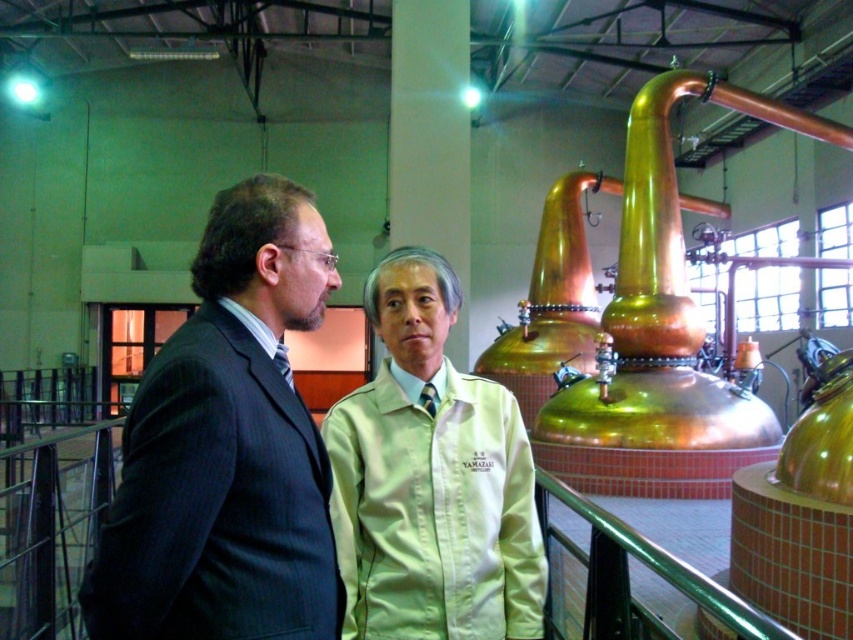
You are a photographer setting up a shoot in this distillery. You need to ensure that the dark gray pinstripe suit at left and the light beige fabric shirt at center are both visible in the frame. Given their sizes, which one might require more careful framing to ensure it doesn not get lost in the background of the industrial stills?

The dark gray pinstripe suit at left has a smaller size compared to light beige fabric shirt at center, so it might require more careful framing to ensure it doesn not get lost in the background of the industrial stills.

In the scene shown: You are standing at the origin point of the coordinate system in this image. The dark gray pinstripe suit at left is located at point (227, 448). If you were to walk directly towards the dark gray pinstripe suit at left, would you first encounter the dark gray pinstripe suit at left or the green railing before reaching it?

The dark gray pinstripe suit at left is located at point (227, 448), so walking directly towards it would first encounter the dark gray pinstripe suit at left before reaching the green railing.

You are a photographer positioned at the entrance of the distillery. You need to capture a photo where both the dark gray pinstripe suit at left and the light beige fabric shirt at center are in focus. Given that your camera can only focus on objects within a 1.2 meter depth range, will you be able to achieve this?

The dark gray pinstripe suit at left is closer to the viewer than the light beige fabric shirt at center. Since the camera can focus on objects within a 1.2 meter depth range, you need to check the distance between them. However, the exact distance isn not provided, so it depends on whether their separation is within the 1.2 meter range. Without specific measurements, we cannot confirm if they will both be in focus.